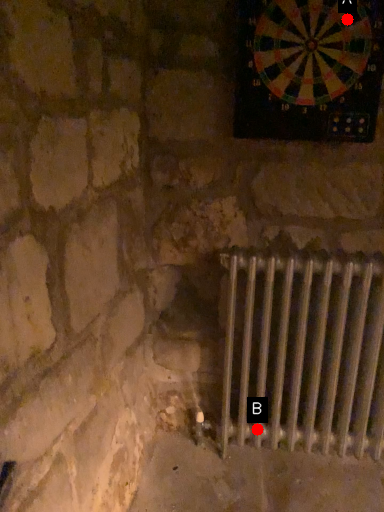
Question: Two points are circled on the image, labeled by A and B beside each circle. Among these points, which one is nearest to the camera?

Choices:
 (A) A is closer
 (B) B is closer

Answer: (A)